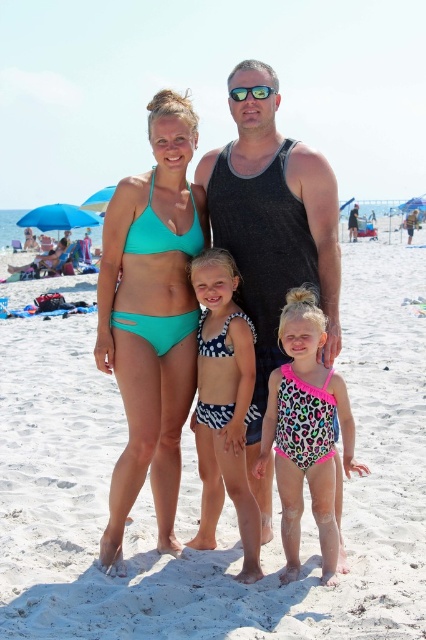
You are a photographer trying to capture a closeup of the family while standing at a specific point. You need to determine which of the two points, point A at coordinates point (333, 518) or point B at coordinates point (236, 97), is closer to you to ensure proper focus. Which point should you focus on?

Point A at coordinates point (333, 518) is closer to the viewer than point B at coordinates point (236, 97), so you should focus on point A to ensure proper focus.

You are a photographer taking a picture of the family. You want to place a seashell decoration on the sand so it appears to the right of the teal bikini top at center in the photo. Based on the scene, where should you place the seashell relative to the white sand at center?

You should place the seashell to the right of the white sand at center because the white sand at center is to the left of the teal bikini top at center. Therefore, placing the seashell to the right of the white sand at center would position it to the right of the teal bikini top at center in the photo.